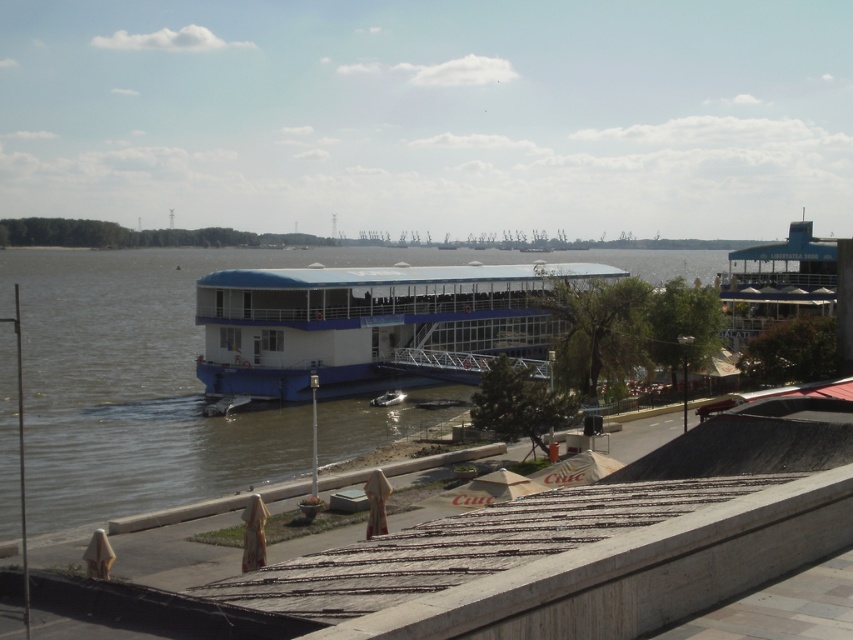
You are standing on the dock and want to board the closest boat. Which boat should you choose between the white glossy boat at center and the metallic silver boat at center?

The white glossy boat at center is 10.14 meters away from the metallic silver boat at center. Since you want to board the closest boat, you should choose whichever is nearest to you. However, the description only provides the distance between them, not their individual distances from your position. Without knowing your exact location relative to both boats, it is impossible to determine which one is closer to you.

Looking at this image, you are standing on the boat and want to move from the point at coordinates point (x=410, y=365) to the point at coordinates point (x=399, y=397). Which direction should you move to get closer to the shore?

You should move towards point (x=399, y=397) because it is closer to the shore than point (x=410, y=365).